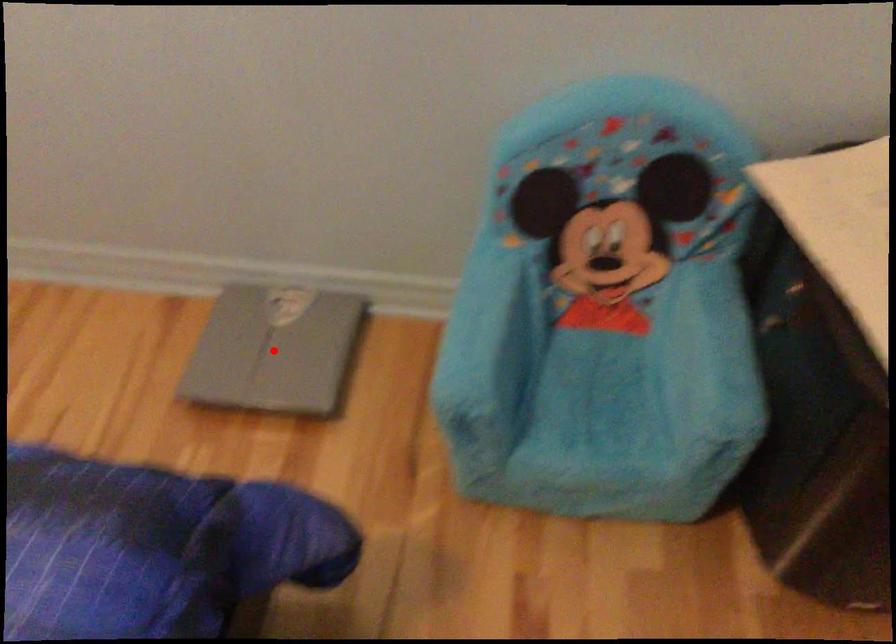
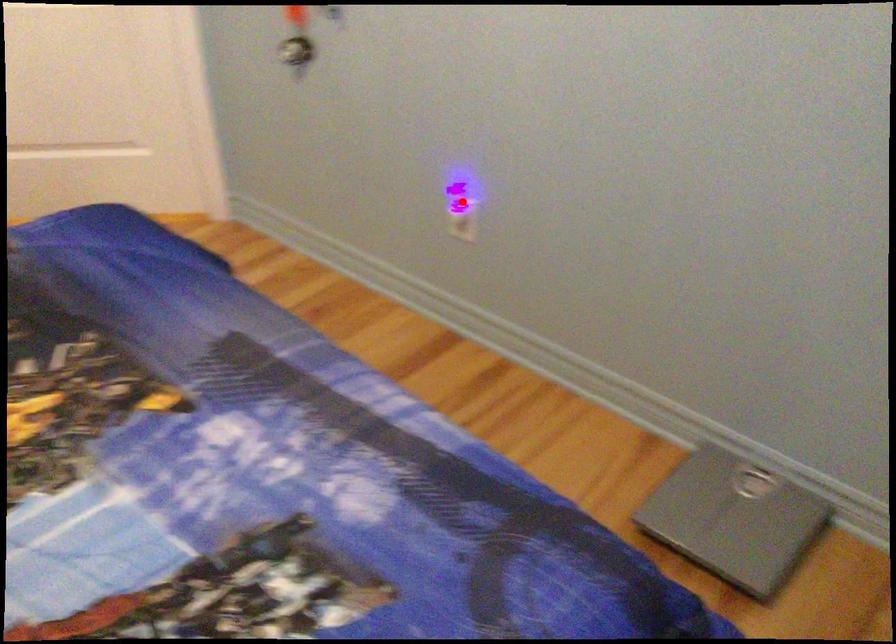
I am providing you with two images of the same scene from different viewpoints. A red point is marked on the first image and another point is marked on the second image. Is the marked point in image1 the same physical position as the marked point in image2?

No